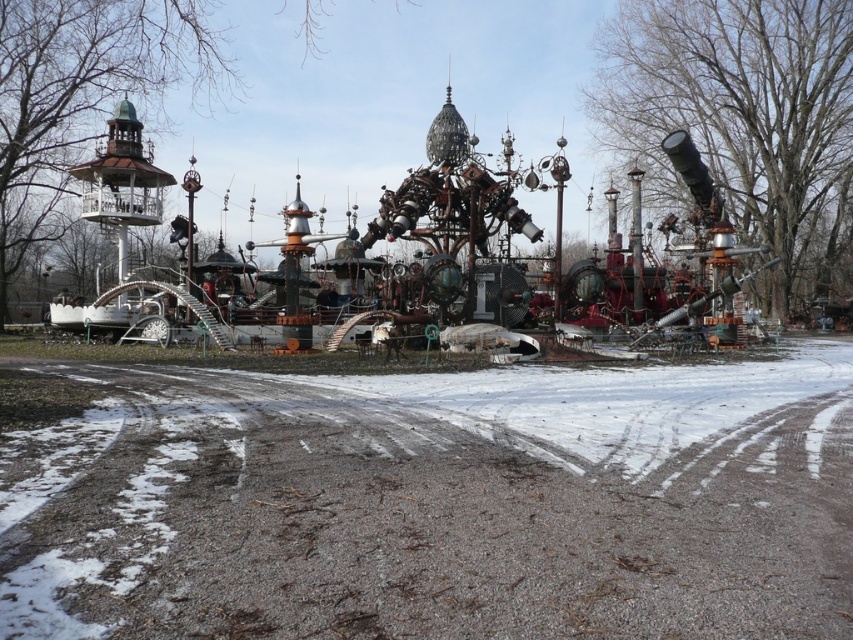
From the picture: Which is more to the left, white powdery snow at center or rusty metal amusement park at center?

Positioned to the left is white powdery snow at center.

Who is lower down, white powdery snow at center or rusty metal amusement park at center?

white powdery snow at center

Is point (683, 522) positioned in front of point (645, 317)?

Yes, it is.

This screenshot has width=853, height=640. In order to click on white powdery snow at center in this screenshot , I will do `click(437, 504)`.